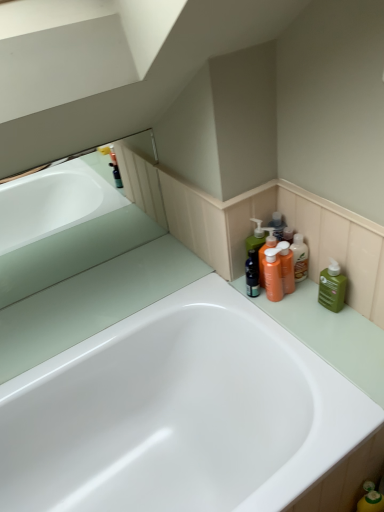
The image size is (384, 512). I want to click on free space that is in between orange matte pump bottle at upper right, which is counted as the 1th cleaning product, starting from the left, and green matte bottle at right, marked as the second cleaning product in a left-to-right arrangement, so click(307, 301).